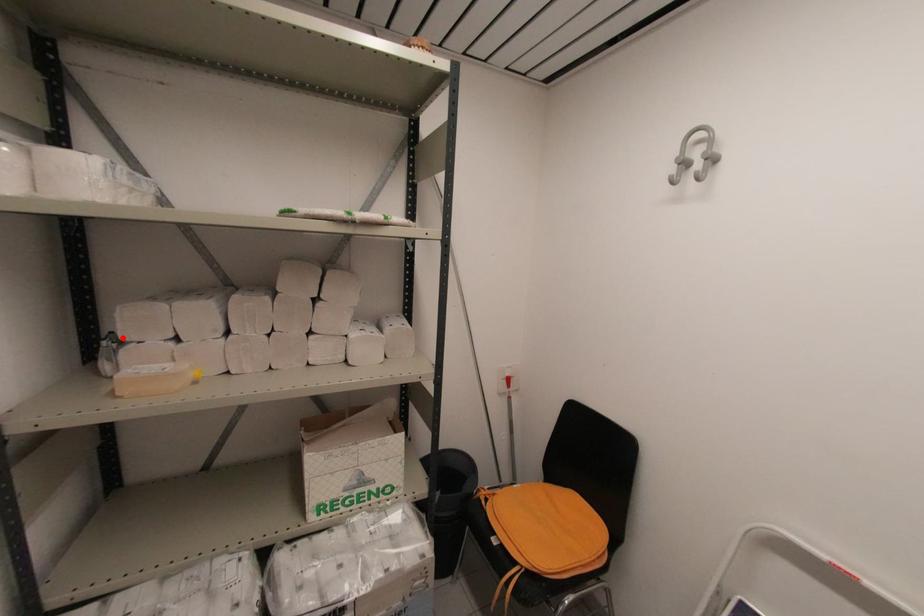
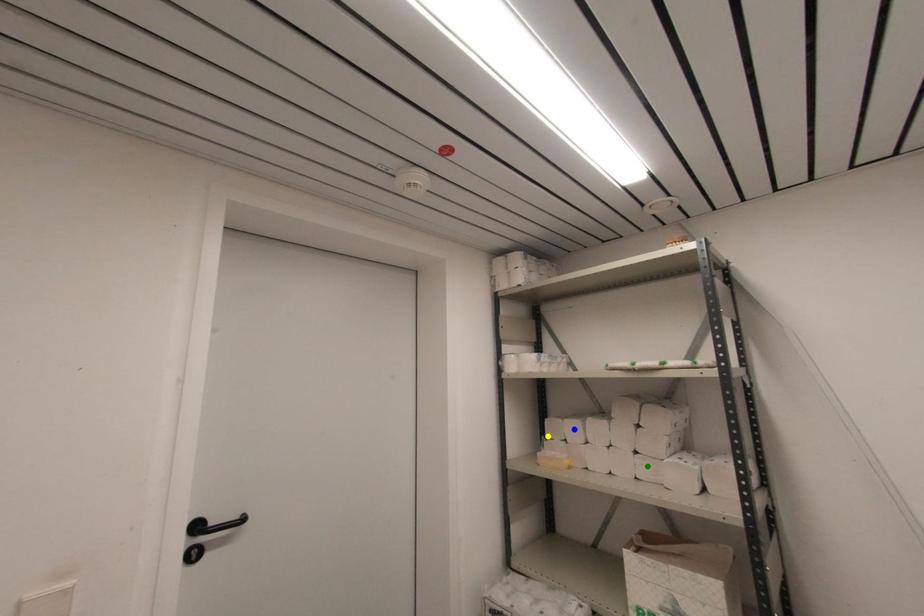
Question: I am providing you with two images of the same scene from different viewpoints. A red point is marked on the first image. You are given multiple points on the second image. Which mark in image 2 goes with the point in image 1?

Choices:
 (A) yellow point
 (B) green point
 (C) blue point

Answer: (A)